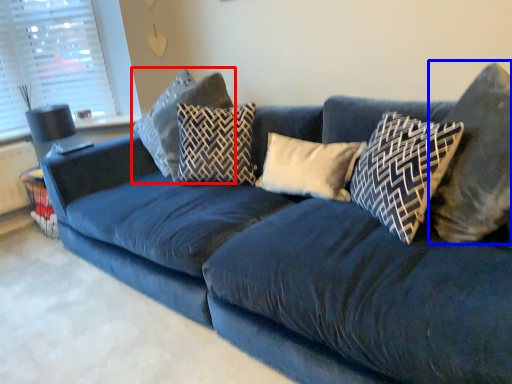
Question: Which point is closer to the camera, pillow (highlighted by a red box) or pillow (highlighted by a blue box)?

Choices:
 (A) pillow
 (B) pillow

Answer: (B)